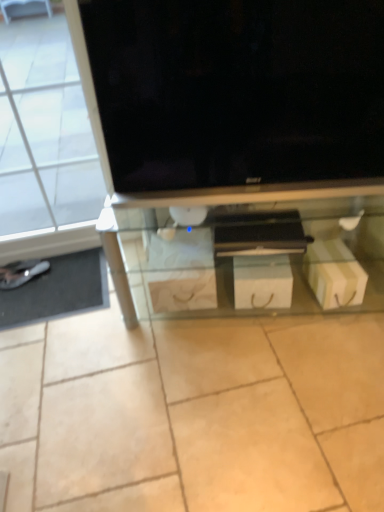
Question: Looking at their shapes, would you say transparent glass door at left is wider or thinner than shiny silver shoe at lower left?

Choices:
 (A) wide
 (B) thin

Answer: (B)

Question: Is transparent glass door at left situated inside shiny silver shoe at lower left or outside?

Choices:
 (A) outside
 (B) inside

Answer: (A)

Question: Which object is the farthest from the black glossy tv at upper center?

Choices:
 (A) transparent glass shelf at center
 (B) transparent glass door at left
 (C) white cardboard box at lower right
 (D) white cardboard drawer at center
 (E) shiny silver shoe at lower left

Answer: (E)

Question: Which object is the farthest from the white cardboard box at lower right?

Choices:
 (A) white cardboard drawer at center
 (B) metallic silver flat at lower left
 (C) shiny silver shoe at lower left
 (D) black glossy tv at upper center
 (E) transparent glass shelf at center

Answer: (C)